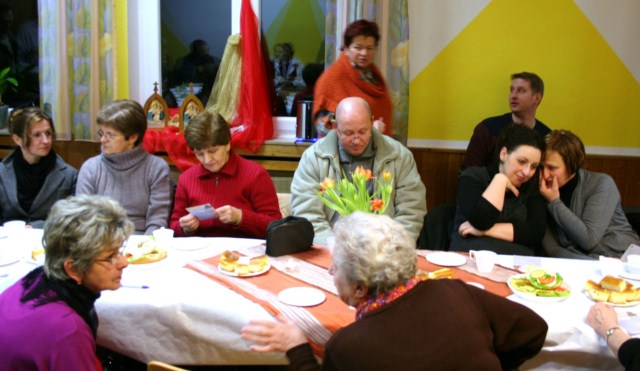
Identify the location of black purse on table. This screenshot has width=640, height=371. (292, 227).